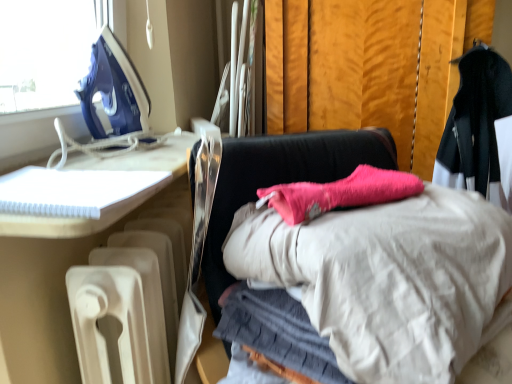
Question: Based on their positions, is white plastic notebook at left, which is counted as the 1th furniture, starting from the left, located to the left or right of black woolen coat at upper right?

Choices:
 (A) left
 (B) right

Answer: (A)

Question: Relative to black woolen coat at upper right, is white plastic notebook at left, which ranks as the 3th furniture in right-to-left order, in front or behind?

Choices:
 (A) behind
 (B) front

Answer: (B)

Question: Which object is positioned closest to the white plastic radiator at lower left, which ranks as the second furniture in right-to-left order?

Choices:
 (A) black woolen coat at upper right
 (B) blue plastic iron at upper left
 (C) pink fabric at center, which is the 3th furniture from left to right
 (D) white plastic notebook at left, which is counted as the 1th furniture, starting from the left

Answer: (D)

Question: Considering the real-world distances, which object is closest to the blue plastic iron at upper left?

Choices:
 (A) white plastic notebook at left, which is counted as the 1th furniture, starting from the left
 (B) white plastic radiator at lower left, which ranks as the second furniture in right-to-left order
 (C) pink fabric at center, which is the 3th furniture from left to right
 (D) black woolen coat at upper right

Answer: (A)